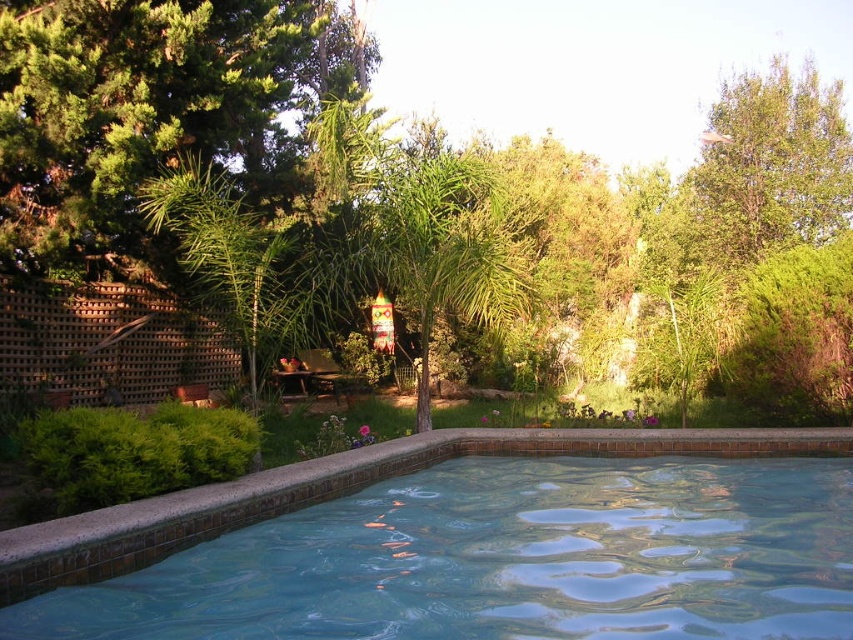
Looking at this image, you are standing at the edge of the swimming pool and looking towards the green leafy tree at upper center and the green leafy palm tree at center. Which tree appears taller from your vantage point?

The green leafy tree at upper center appears much taller than the green leafy palm tree at center from your vantage point at the pool edge.

You are planning to install a new bench in the backyard. The bench requires at least 2 meters of space between it and any nearby objects to ensure safety. If you place the bench exactly halfway between the smooth concrete pool at center and the green leafy palm tree at center, will there be enough space between the bench and both objects?

The distance between the smooth concrete pool at center and the green leafy palm tree at center is 3.20 meters. Placing the bench halfway would mean it is 1.60 meters away from both objects. Since the required space is at least 2 meters, there will not be enough space between the bench and both objects.

You are standing in the backyard looking at the swimming pool. There are two points marked in the image. One is at coordinates point (90, 568) and the other at point (16, 83). Which of these points is nearer to you?

Point (90, 568) is closer to the viewer than point (16, 83).